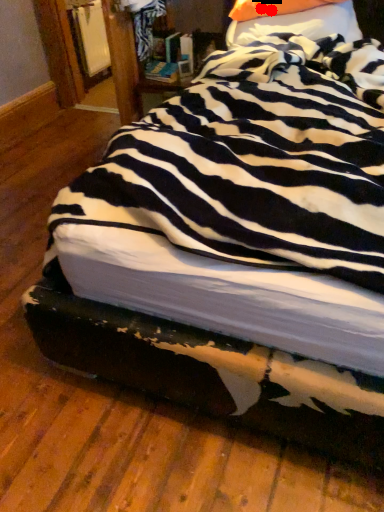
Question: Two points are circled on the image, labeled by A and B beside each circle. Which point appears farthest from the camera in this image?

Choices:
 (A) A is further
 (B) B is further

Answer: (A)